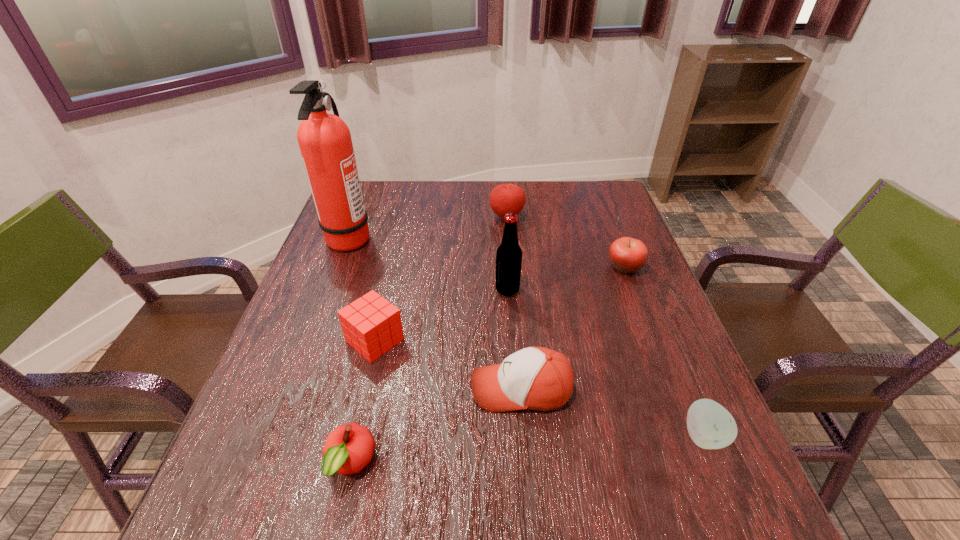
You are a GUI agent. You are given a task and a screenshot of the screen. Output one action in this format:
    pyautogui.click(x=<x>, y=<y>)
    Task: Click on the apple present at the far edge
    The width and height of the screenshot is (960, 540).
    Given the screenshot: What is the action you would take?
    pyautogui.click(x=506, y=198)

Identify the location of object at the near edge. (348, 449).

Locate an element on the screen. The width and height of the screenshot is (960, 540). fire extinguisher that is at the left edge is located at coordinates (325, 143).

Identify the location of cube located in the left edge section of the desktop. The height and width of the screenshot is (540, 960). (371, 325).

I want to click on object present at the far left corner, so click(x=325, y=143).

Where is `free space at the far edge of the desktop`? This screenshot has width=960, height=540. free space at the far edge of the desktop is located at coordinates (394, 201).

This screenshot has width=960, height=540. What are the coordinates of `vacant space at the near edge of the desktop` in the screenshot? It's located at (608, 530).

Identify the location of vacant region at the left edge. (360, 295).

Identify the location of vacant region at the right edge of the desktop. coord(626,298).

Locate an element on the screen. This screenshot has height=540, width=960. vacant space at the far left corner of the desktop is located at coordinates (368, 198).